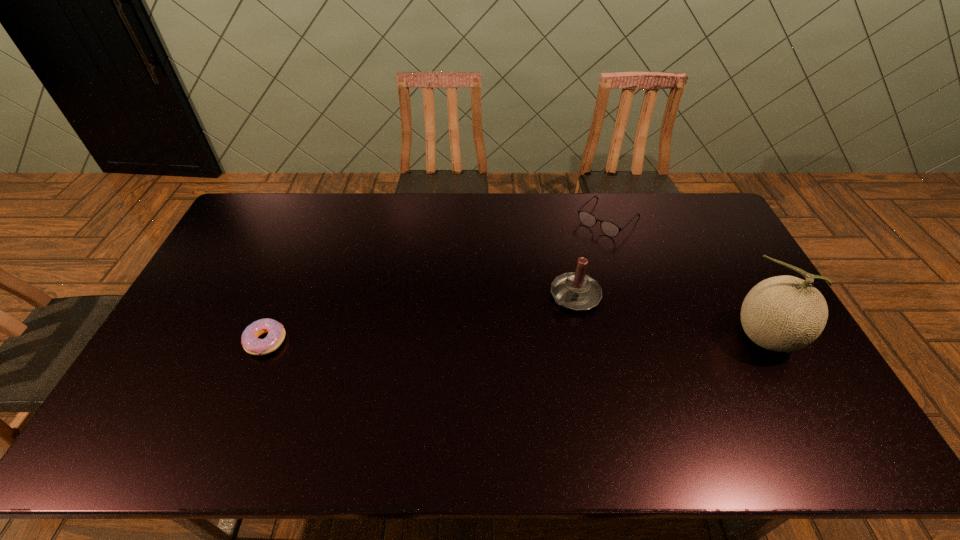
The image size is (960, 540). I want to click on empty space that is in between the farthest object and the leftmost object, so click(437, 280).

Identify the location of vacant area between the farthest object and the rightmost object. (687, 278).

Identify which object is the nearest to the doughnut. Please provide its 2D coordinates. Your answer should be formatted as a tuple, i.e. [(x, y)], where the tuple contains the x and y coordinates of a point satisfying the conditions above.

[(576, 291)]

Select which object appears as the closest to the third tallest object. Please provide its 2D coordinates. Your answer should be formatted as a tuple, i.e. [(x, y)], where the tuple contains the x and y coordinates of a point satisfying the conditions above.

[(576, 291)]

Locate an element on the screen. This screenshot has height=540, width=960. vacant space that satisfies the following two spatial constraints: 1. on the back side of the shortest object; 2. on the left side of the cantaloup is located at coordinates pos(268,337).

Find the location of a particular element. Image resolution: width=960 pixels, height=540 pixels. free location that satisfies the following two spatial constraints: 1. on the front side of the candle; 2. on the right side of the tallest object is located at coordinates (584, 337).

The height and width of the screenshot is (540, 960). I want to click on free space that satisfies the following two spatial constraints: 1. on the back side of the leftmost object; 2. on the right side of the rightmost object, so click(x=268, y=337).